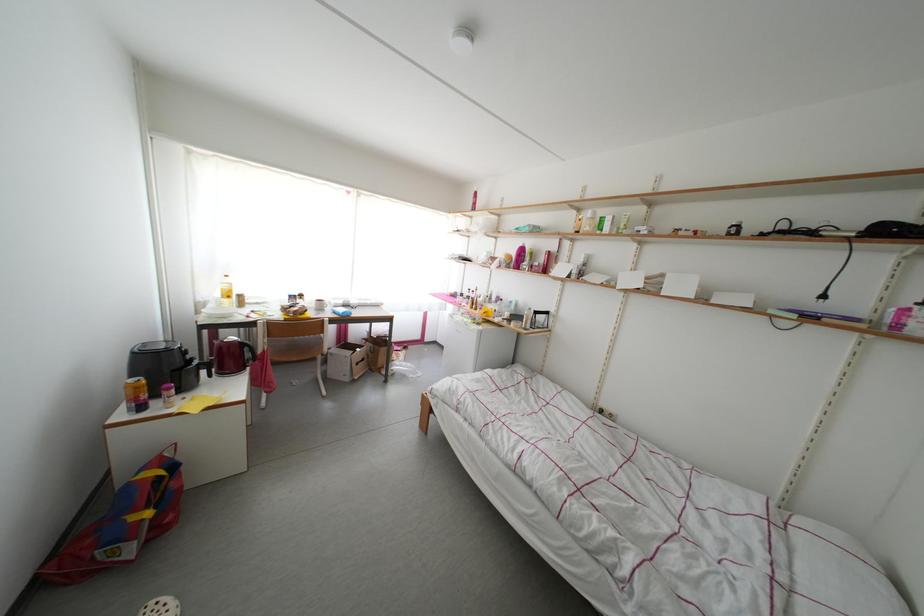
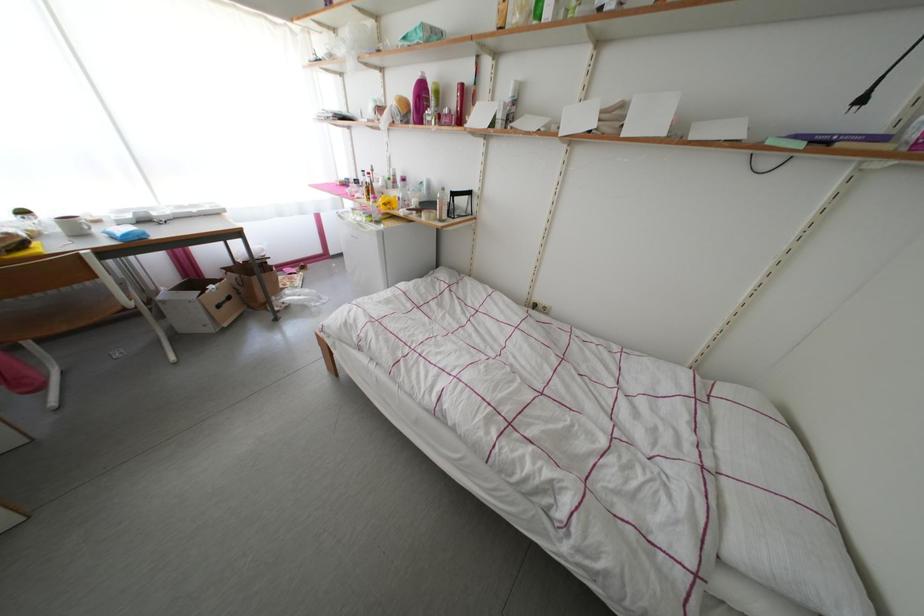
Looking at this image, in a continuous first-person perspective shot, in which direction is the camera moving?

The cameraman moved toward right, forward.